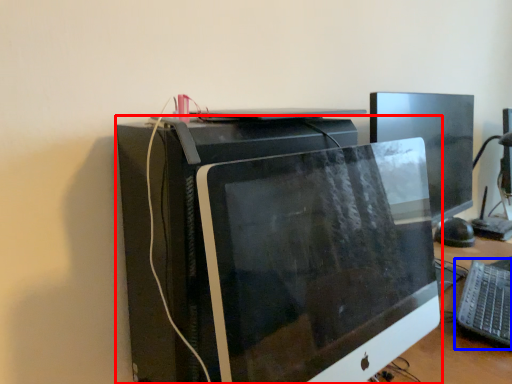
Question: Which object appears farthest to the camera in this image, computer monitor (highlighted by a red box) or computer keyboard (highlighted by a blue box)?

Choices:
 (A) computer monitor
 (B) computer keyboard

Answer: (B)